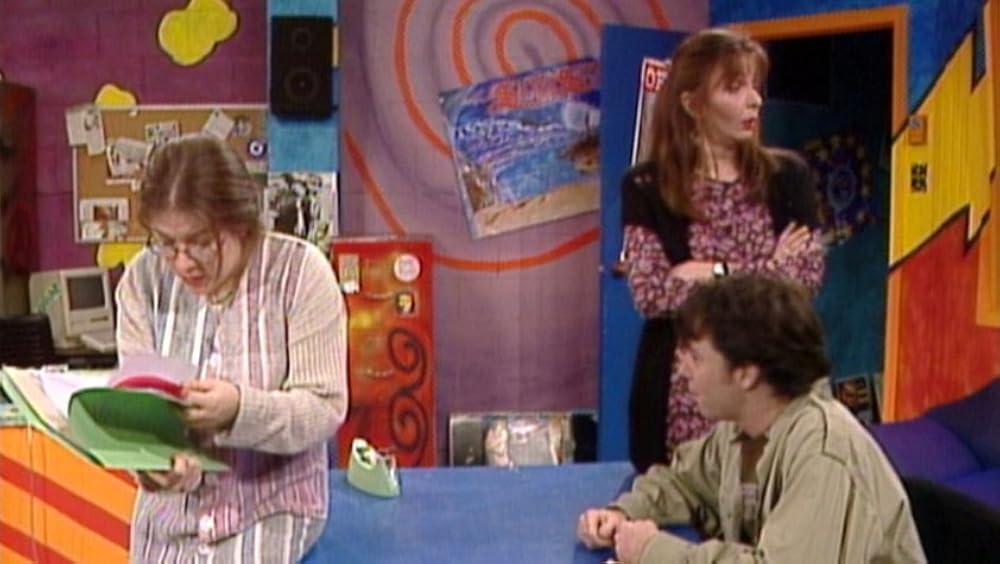
Locate an element on the screen. Image resolution: width=1000 pixels, height=564 pixels. monitor is located at coordinates (88, 286).